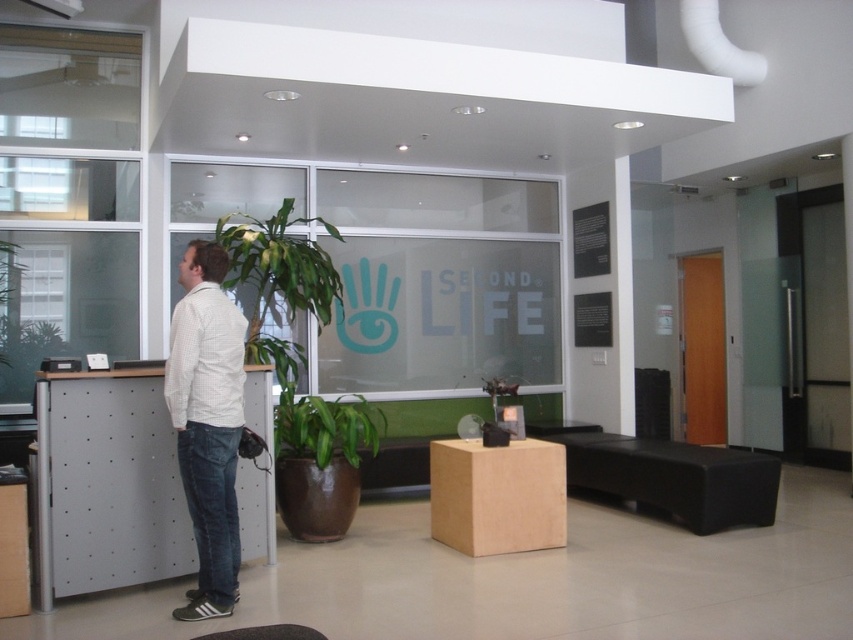
You are a person with a height of 1.7 meters. You are standing at the black leather stool at lower center and want to reach the green glossy plant at center to water it. Can you reach the plant without moving from the stool?

The green glossy plant at center is 2.93 meters away from the black leather stool at lower center. Since the distance is greater than the average arm length of a person, you cannot reach the plant without moving from the stool.

You are a visitor in the office and need to sit down. You see a green glossy plant at center and a black leather stool at lower center. Which object is closer to your right side if you are facing the reception desk?

The black leather stool at lower center is closer to your right side because the green glossy plant at center is to the left of it, meaning the stool is positioned to the right relative to the plant.